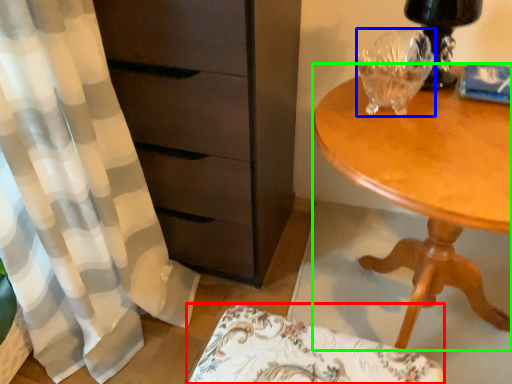
Question: Estimate the real-world distances between objects in this image. Which object is farther from swivel chair (highlighted by a red box), glass vase (highlighted by a blue box) or desk (highlighted by a green box)?

Choices:
 (A) glass vase
 (B) desk

Answer: (A)